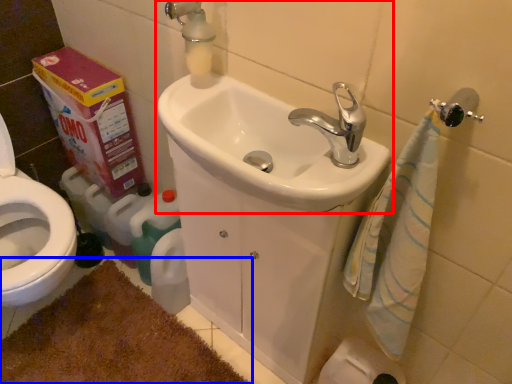
Question: Among these objects, which one is nearest to the camera, sink (highlighted by a red box) or bath mat (highlighted by a blue box)?

Choices:
 (A) sink
 (B) bath mat

Answer: (A)